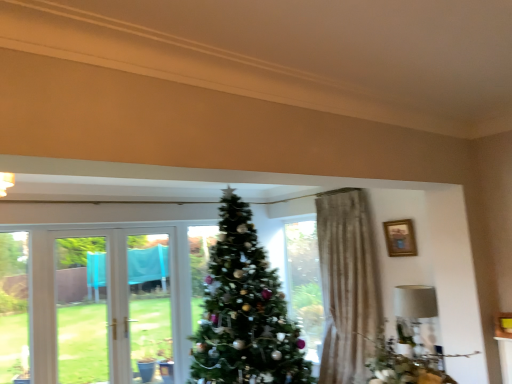
Question: Can you confirm if wooden framed picture at upper right is positioned to the left of white fabric lampshade at right?

Choices:
 (A) no
 (B) yes

Answer: (B)

Question: Are wooden framed picture at upper right and white fabric lampshade at right beside each other?

Choices:
 (A) yes
 (B) no

Answer: (B)

Question: From the image's perspective, is wooden framed picture at upper right beneath white fabric lampshade at right?

Choices:
 (A) no
 (B) yes

Answer: (A)

Question: Can you confirm if wooden framed picture at upper right is thinner than white fabric lampshade at right?

Choices:
 (A) no
 (B) yes

Answer: (B)

Question: Does wooden framed picture at upper right have a smaller size compared to white fabric lampshade at right?

Choices:
 (A) yes
 (B) no

Answer: (A)

Question: Looking at the image, does wooden framed picture at upper right seem bigger or smaller compared to white fabric lampshade at right?

Choices:
 (A) big
 (B) small

Answer: (B)

Question: Is wooden framed picture at upper right to the left or to the right of white fabric lampshade at right in the image?

Choices:
 (A) right
 (B) left

Answer: (B)

Question: Would you say wooden framed picture at upper right is inside or outside white fabric lampshade at right?

Choices:
 (A) outside
 (B) inside

Answer: (A)

Question: In terms of height, does wooden framed picture at upper right look taller or shorter compared to white fabric lampshade at right?

Choices:
 (A) tall
 (B) short

Answer: (B)

Question: Considering their positions, is green textured christmas tree at center located in front of or behind white fabric lampshade at right?

Choices:
 (A) front
 (B) behind

Answer: (A)

Question: Is green textured christmas tree at center inside the boundaries of white fabric lampshade at right, or outside?

Choices:
 (A) inside
 (B) outside

Answer: (B)

Question: Looking at their shapes, would you say green textured christmas tree at center is wider or thinner than white fabric lampshade at right?

Choices:
 (A) thin
 (B) wide

Answer: (B)

Question: From a real-world perspective, is green textured christmas tree at center above or below white fabric lampshade at right?

Choices:
 (A) below
 (B) above

Answer: (B)

Question: Considering the positions of point (416, 337) and point (260, 365), is point (416, 337) closer or farther from the camera than point (260, 365)?

Choices:
 (A) closer
 (B) farther

Answer: (A)

Question: Is white fabric lampshade at right wider or thinner than green textured christmas tree at center?

Choices:
 (A) wide
 (B) thin

Answer: (B)